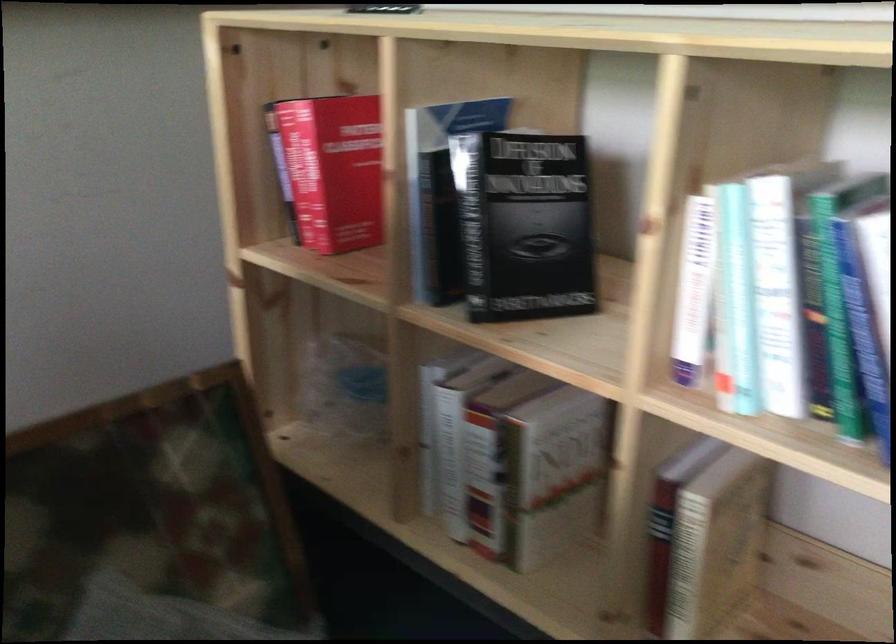
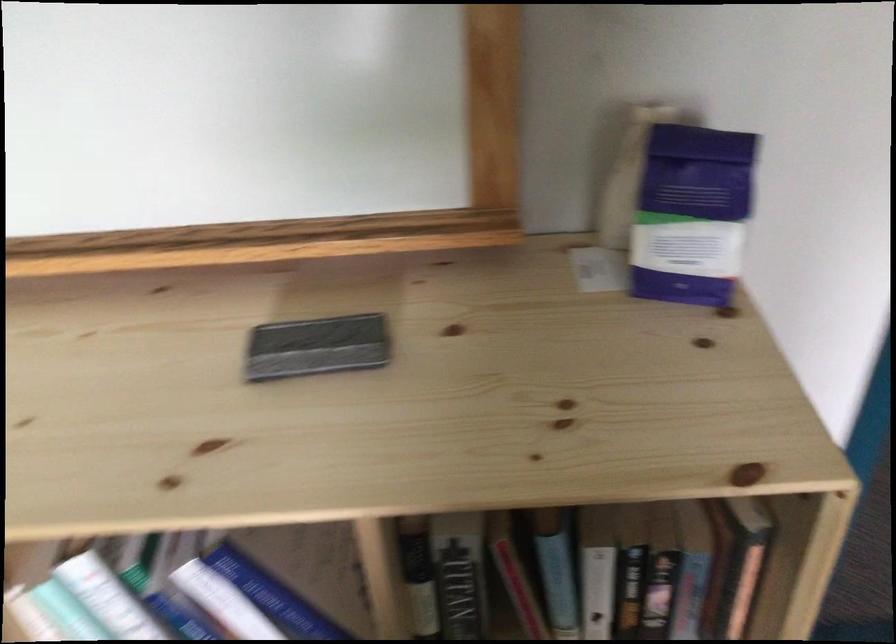
Find the pixel in the second image that matches point 780,252 in the first image.

(166, 612)